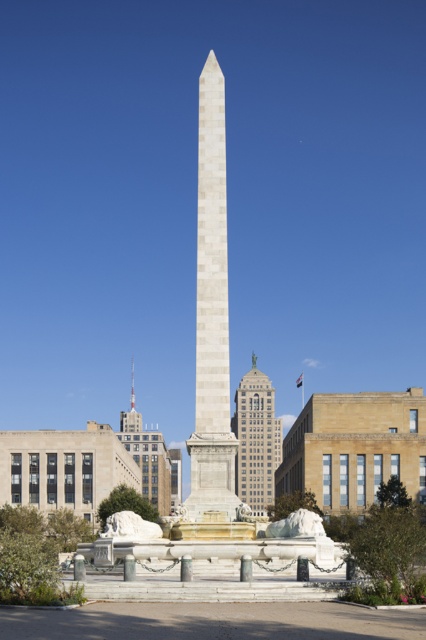
You are standing at the entrance of the plaza and want to walk to the gray stone building at center. The white marble obelisk at center is blocking your path. Can you walk around it to reach the building?

The white marble obelisk at center and gray stone building at center are 533.26 feet apart. Since the distance between them is quite large, you can easily walk around the obelisk to reach the gray stone building at center.

You are standing at the camera position and want to take a photo of the white marble obelisk at center. If your camera can capture objects up to 200 feet away, will you be able to photograph the obelisk clearly?

The white marble obelisk at center and camera are 177.35 feet apart from each other. Since 177.35 feet is less than 200 feet, the camera can capture the obelisk clearly within its range.

Consider the image. You are standing in the public square and want to take a photo of the white marble obelisk at center and the gray stone building at center. Which object should you position to your right side to include both in the frame?

You should position the gray stone building at center to your right side because the white marble obelisk at center is to the left of it, so placing the building on your right will allow both to be captured in the photo.